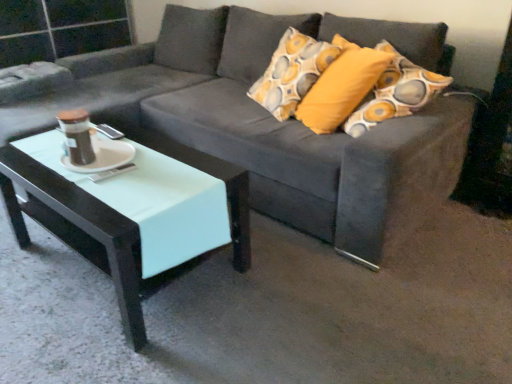
In order to click on vacant space in front of white glossy saucer at center in this screenshot , I will do `click(94, 185)`.